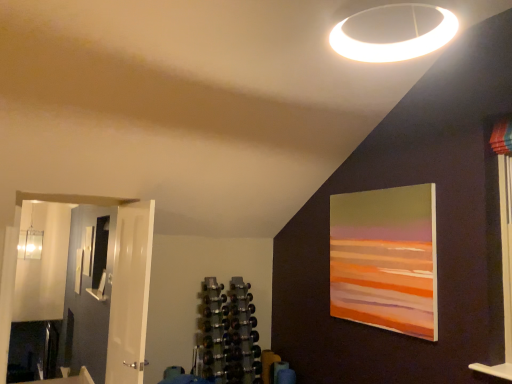
Question: Does metallic dumbbell rack at center come behind white glossy door at left?

Choices:
 (A) yes
 (B) no

Answer: (A)

Question: From a real-world perspective, is metallic dumbbell rack at center physically below white glossy door at left?

Choices:
 (A) yes
 (B) no

Answer: (A)

Question: From the image's perspective, is metallic dumbbell rack at center beneath white glossy door at left?

Choices:
 (A) no
 (B) yes

Answer: (B)

Question: Can you confirm if metallic dumbbell rack at center is smaller than white glossy door at left?

Choices:
 (A) no
 (B) yes

Answer: (A)

Question: Considering the relative positions of metallic dumbbell rack at center and white glossy door at left in the image provided, is metallic dumbbell rack at center in front of white glossy door at left?

Choices:
 (A) yes
 (B) no

Answer: (B)

Question: Is matte white picture frame at left, the 1th picture frame viewed from the left, in front of or behind white glossy door at left in the image?

Choices:
 (A) front
 (B) behind

Answer: (B)

Question: From the image's perspective, is matte white picture frame at left, the 1th picture frame viewed from the left, located above or below white glossy door at left?

Choices:
 (A) below
 (B) above

Answer: (A)

Question: From their relative heights in the image, would you say matte white picture frame at left, placed as the 1th picture frame when sorted from bottom to top, is taller or shorter than white glossy door at left?

Choices:
 (A) short
 (B) tall

Answer: (A)

Question: Considering the positions of matte white picture frame at left, placed as the 1th picture frame when sorted from back to front, and white glossy door at left in the image, is matte white picture frame at left, placed as the 1th picture frame when sorted from back to front, bigger or smaller than white glossy door at left?

Choices:
 (A) small
 (B) big

Answer: (A)

Question: Would you say metallic dumbbell rack at center is to the left or to the right of white glossy door at left in the picture?

Choices:
 (A) left
 (B) right

Answer: (B)

Question: Is metallic dumbbell rack at center in front of or behind white glossy door at left in the image?

Choices:
 (A) front
 (B) behind

Answer: (B)

Question: From a real-world perspective, is metallic dumbbell rack at center above or below white glossy door at left?

Choices:
 (A) below
 (B) above

Answer: (A)

Question: In terms of width, does metallic dumbbell rack at center look wider or thinner when compared to white glossy door at left?

Choices:
 (A) wide
 (B) thin

Answer: (A)

Question: Considering the positions of white glossy door at left and matte white picture frame at left, the 2th picture frame viewed from the right, in the image, is white glossy door at left wider or thinner than matte white picture frame at left, the 2th picture frame viewed from the right,?

Choices:
 (A) thin
 (B) wide

Answer: (B)

Question: From their relative heights in the image, would you say white glossy door at left is taller or shorter than matte white picture frame at left, placed as the 1th picture frame when sorted from bottom to top?

Choices:
 (A) tall
 (B) short

Answer: (A)